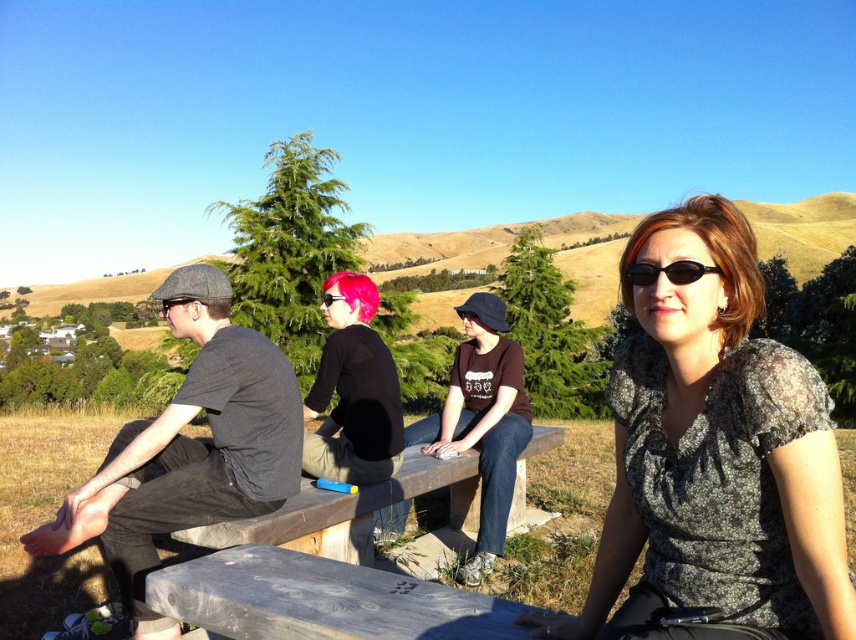
Question: Estimate the real-world distances between objects in this image. Which object is closer to the matte black dress at center?

Choices:
 (A) matte black shirt at center
 (B) wooden bench at center

Answer: (B)

Question: Is matte black shirt at center positioned behind pink matte goggles at center?

Choices:
 (A) yes
 (B) no

Answer: (B)

Question: Based on their relative distances, which object is farther from the matte black dress at center?

Choices:
 (A) wooden bench at center
 (B) black plastic sunglasses at upper right
 (C) pink matte goggles at center
 (D) dark gray fabric shirt at left

Answer: (C)

Question: Which of the following is the farthest from the observer?

Choices:
 (A) (310, 438)
 (B) (753, 628)
 (C) (312, 486)
 (D) (163, 312)

Answer: (A)

Question: Is black plastic sunglasses at upper right further to the viewer compared to pink matte hair at center?

Choices:
 (A) yes
 (B) no

Answer: (B)

Question: Is the position of wooden bench at center more distant than that of black plastic sunglasses at upper right?

Choices:
 (A) yes
 (B) no

Answer: (A)